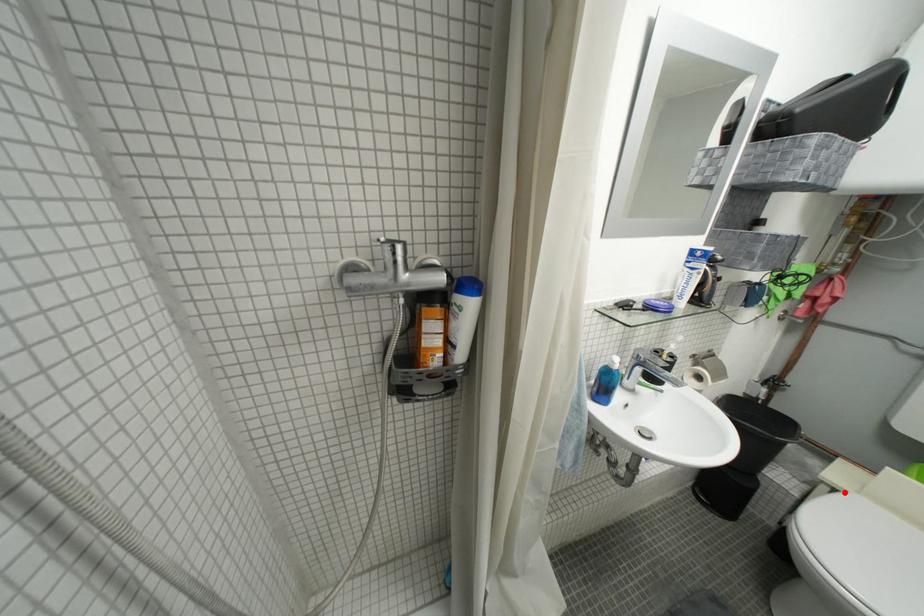
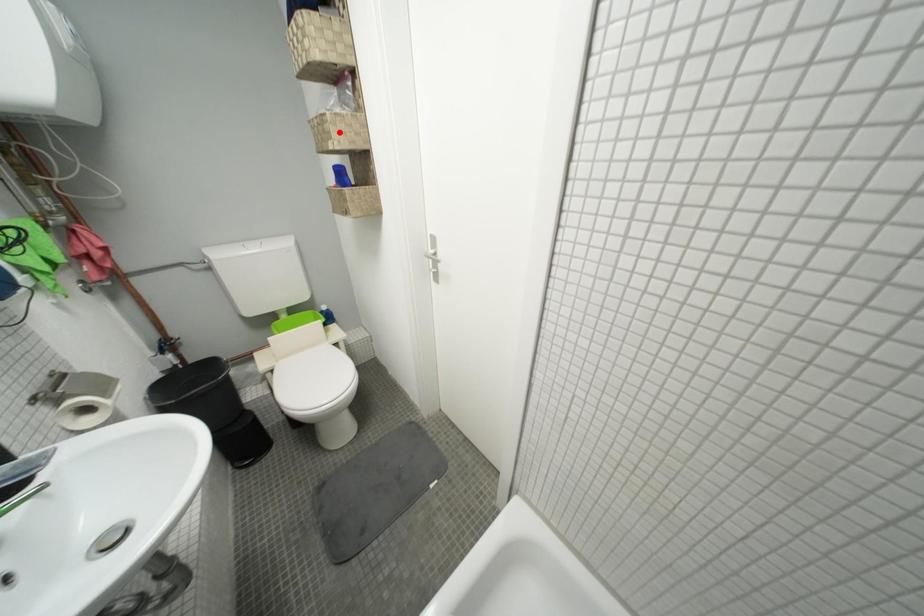
Consider the image. I am providing you with two images of the same scene from different viewpoints. A red point is marked on the first image and another point is marked on the second image. Is the red point in image1 aligned with the point shown in image2?

No